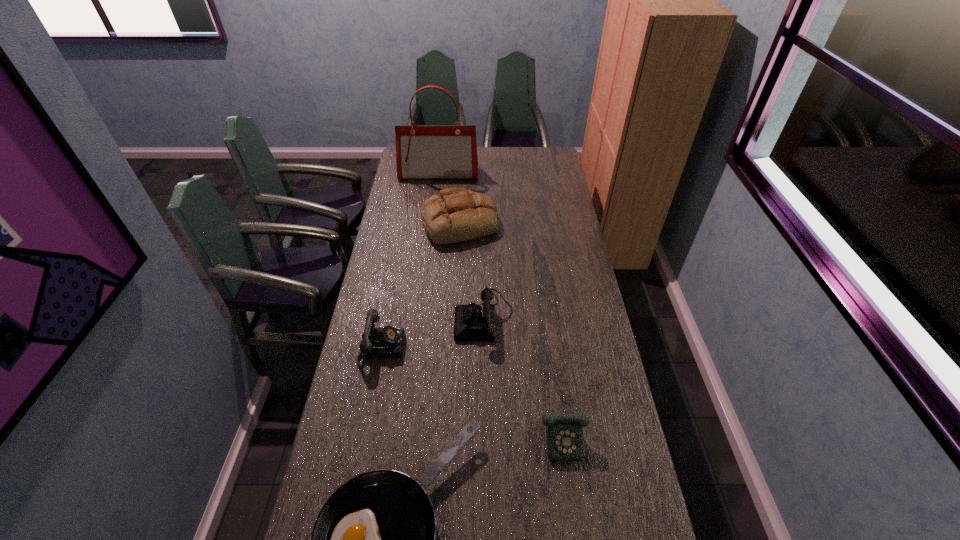
At what (x,y) coordinates should I click in order to perform the action: click on the farthest object. Please return your answer as a coordinate pair (x, y). This screenshot has height=540, width=960. Looking at the image, I should click on (422, 151).

Where is `the tallest object`? the tallest object is located at coordinates (422, 151).

Locate an element on the screen. the fifth nearest object is located at coordinates (454, 215).

The width and height of the screenshot is (960, 540). Identify the location of bread. coord(454,215).

Locate an element on the screen. This screenshot has width=960, height=540. the second telephone from right to left is located at coordinates (472, 322).

In order to click on the leftmost telephone in this screenshot , I will do `click(382, 342)`.

Image resolution: width=960 pixels, height=540 pixels. Find the location of `the second shortest object`. the second shortest object is located at coordinates (564, 432).

You are a GUI agent. You are given a task and a screenshot of the screen. Output one action in this format:
    pyautogui.click(x=<x>, y=<y>)
    Task: Click on the nearest telephone
    The height and width of the screenshot is (540, 960).
    Given the screenshot: What is the action you would take?
    pyautogui.click(x=564, y=432)

In order to click on free spot located 0.170m on the front of the farthest object in this screenshot , I will do `click(436, 201)`.

The width and height of the screenshot is (960, 540). Identify the location of vacant space located on the front of the bread. (457, 278).